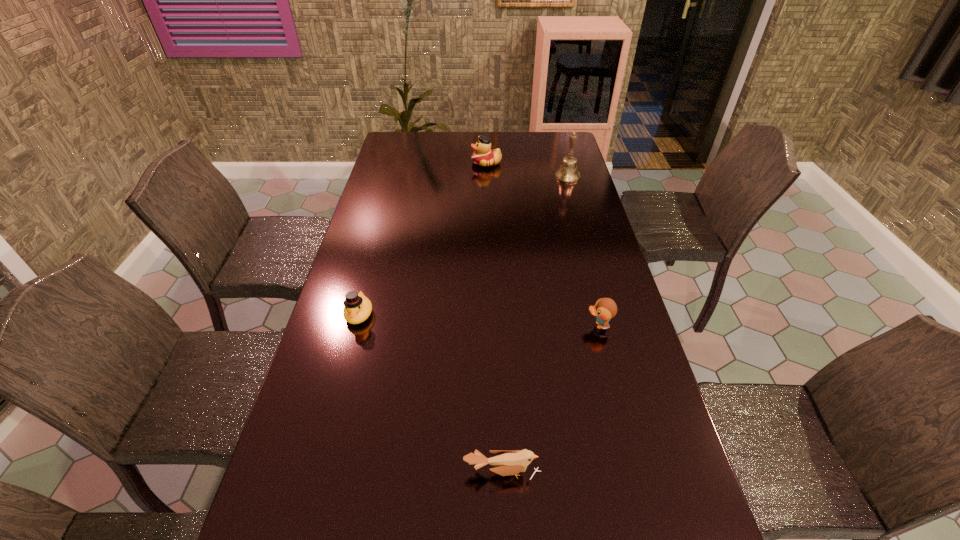
Identify the location of vacant area at the right edge. Image resolution: width=960 pixels, height=540 pixels. (695, 531).

Where is `free space between the nearest object and the bell`? This screenshot has height=540, width=960. free space between the nearest object and the bell is located at coordinates (535, 324).

At what (x,y) coordinates should I click in order to perform the action: click on unoccupied position between the leftmost object and the second duck from left to right. Please return your answer as a coordinate pair (x, y). The image size is (960, 540). Looking at the image, I should click on (422, 239).

Locate an element on the screen. The width and height of the screenshot is (960, 540). empty location between the bird and the leftmost duck is located at coordinates (431, 393).

What are the coordinates of `empty space that is in between the bird and the rightmost duck` in the screenshot? It's located at (550, 399).

The width and height of the screenshot is (960, 540). In order to click on empty space that is in between the farthest duck and the bird in this screenshot , I will do `click(494, 318)`.

At what (x,y) coordinates should I click in order to perform the action: click on free space between the bell and the farthest object. Please return your answer as a coordinate pair (x, y). Looking at the image, I should click on (527, 170).

Locate which object is the closest to the rightmost duck. Please provide its 2D coordinates. Your answer should be formatted as a tuple, i.e. [(x, y)], where the tuple contains the x and y coordinates of a point satisfying the conditions above.

[(507, 463)]

Select which object appears as the third closest to the rightmost duck. Please provide its 2D coordinates. Your answer should be formatted as a tuple, i.e. [(x, y)], where the tuple contains the x and y coordinates of a point satisfying the conditions above.

[(568, 173)]

The image size is (960, 540). What are the coordinates of `the third closest duck to the bird` in the screenshot? It's located at (484, 156).